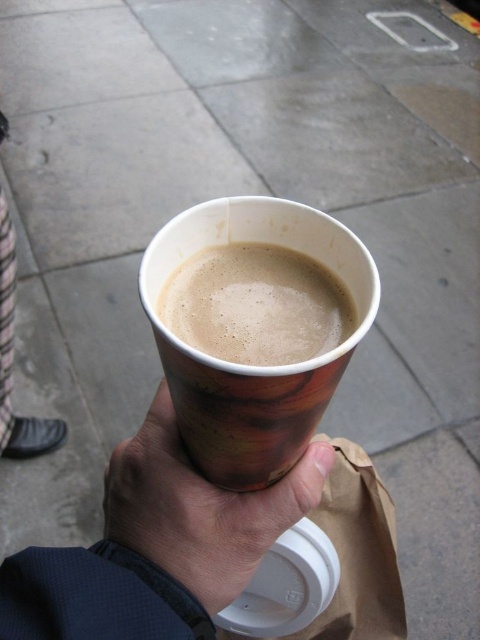
Can you confirm if wooden-patterned cup at center is positioned below brown paper bag at lower center?

Actually, wooden-patterned cup at center is above brown paper bag at lower center.

Is wooden-patterned cup at center to the left of brown paper bag at lower center from the viewer's perspective?

Yes, wooden-patterned cup at center is to the left of brown paper bag at lower center.

Between point (245, 452) and point (365, 547), which one is positioned in front?

Point (245, 452) is in front.

Find the location of a particular element. The image size is (480, 640). wooden-patterned cup at center is located at coordinates (252, 365).

Is point (208, 316) positioned in front of point (352, 500)?

Yes, point (208, 316) is closer to viewer.

Does brown paper cup at center appear over brown paper bag at lower center?

Yes, brown paper cup at center is above brown paper bag at lower center.

Where is `brown paper cup at center`? Image resolution: width=480 pixels, height=640 pixels. brown paper cup at center is located at coordinates (255, 305).

This screenshot has height=640, width=480. What do you see at coordinates (252, 365) in the screenshot?
I see `wooden-patterned cup at center` at bounding box center [252, 365].

Measure the distance between point (208, 365) and camera.

Point (208, 365) is 12.23 inches away from camera.

This screenshot has height=640, width=480. I want to click on wooden-patterned cup at center, so click(252, 365).